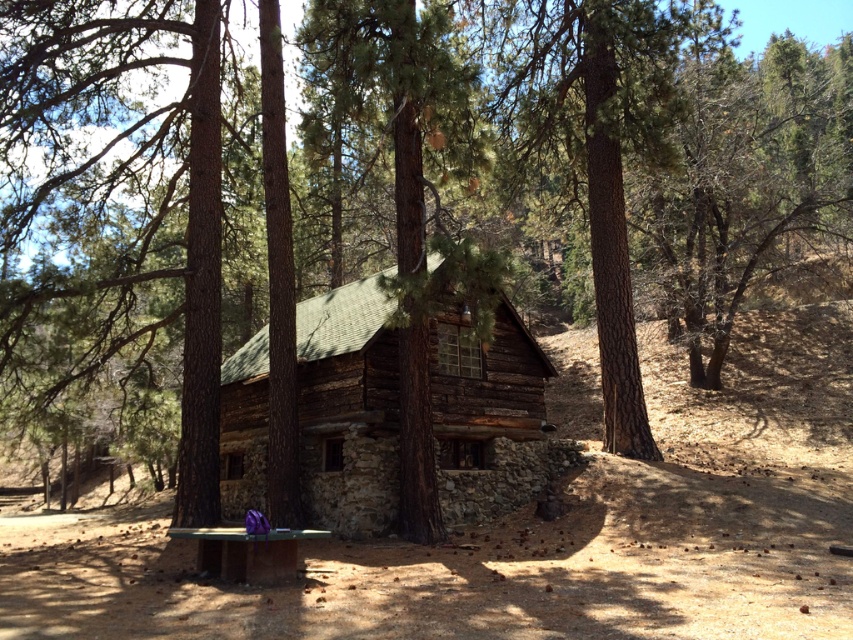
Question: Is weathered wood cabin at center above purple fabric picnic table at lower left?

Choices:
 (A) no
 (B) yes

Answer: (B)

Question: Does weathered wood cabin at center appear over purple fabric picnic table at lower left?

Choices:
 (A) no
 (B) yes

Answer: (B)

Question: Among these objects, which one is farthest from the camera?

Choices:
 (A) weathered wood cabin at center
 (B) purple fabric picnic table at lower left

Answer: (A)

Question: Is weathered wood cabin at center in front of purple fabric picnic table at lower left?

Choices:
 (A) yes
 (B) no

Answer: (B)

Question: Which point is farther from the camera taking this photo?

Choices:
 (A) (252, 509)
 (B) (316, 332)

Answer: (B)